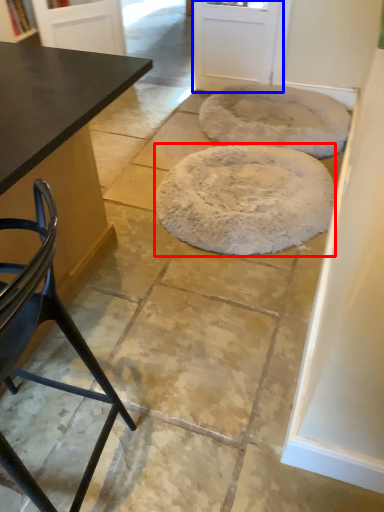
Question: Which object is closer to the camera taking this photo, mat (highlighted by a red box) or screen door (highlighted by a blue box)?

Choices:
 (A) mat
 (B) screen door

Answer: (A)